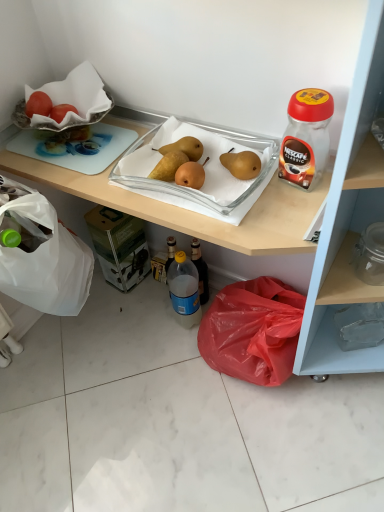
Question: Is transparent plastic jar at upper right, marked as the first bottle in a right-to-left arrangement, shorter than yellow matte pears at center?

Choices:
 (A) no
 (B) yes

Answer: (A)

Question: Does transparent plastic jar at upper right, which is the first bottle from front to back, have a smaller size compared to yellow matte pears at center?

Choices:
 (A) no
 (B) yes

Answer: (A)

Question: Is transparent plastic jar at upper right, which is the first bottle from front to back, facing away from yellow matte pears at center?

Choices:
 (A) yes
 (B) no

Answer: (B)

Question: Can you confirm if transparent plastic jar at upper right, arranged as the second bottle when ordered from the bottom, is thinner than yellow matte pears at center?

Choices:
 (A) yes
 (B) no

Answer: (A)

Question: Is the position of transparent plastic jar at upper right, the 2th bottle when ordered from left to right, more distant than that of yellow matte pears at center?

Choices:
 (A) no
 (B) yes

Answer: (A)

Question: In terms of height, does yellow matte pears at center look taller or shorter compared to transparent plastic jar at upper right, marked as the first bottle in a right-to-left arrangement?

Choices:
 (A) short
 (B) tall

Answer: (A)

Question: Is yellow matte pears at center bigger or smaller than transparent plastic jar at upper right, the 2th bottle when ordered from left to right?

Choices:
 (A) big
 (B) small

Answer: (B)

Question: From the image's perspective, relative to transparent plastic jar at upper right, arranged as the second bottle when ordered from the bottom, is yellow matte pears at center above or below?

Choices:
 (A) below
 (B) above

Answer: (A)

Question: Considering their positions, is yellow matte pears at center located in front of or behind transparent plastic jar at upper right, arranged as the second bottle when ordered from the bottom?

Choices:
 (A) front
 (B) behind

Answer: (B)

Question: In terms of width, does blue translucent bottle at center, the second bottle when ordered from right to left, look wider or thinner when compared to transparent plastic jar at upper right, the first bottle positioned from the top?

Choices:
 (A) thin
 (B) wide

Answer: (B)

Question: Considering the positions of blue translucent bottle at center, which appears as the 1th bottle when viewed from the back, and transparent plastic jar at upper right, the first bottle positioned from the top, in the image, is blue translucent bottle at center, which appears as the 1th bottle when viewed from the back, bigger or smaller than transparent plastic jar at upper right, the first bottle positioned from the top,?

Choices:
 (A) big
 (B) small

Answer: (A)

Question: Is blue translucent bottle at center, the 2th bottle positioned from the top, situated inside transparent plastic jar at upper right, the 2th bottle when ordered from left to right, or outside?

Choices:
 (A) inside
 (B) outside

Answer: (B)

Question: Is blue translucent bottle at center, the second bottle when ordered from right to left, taller or shorter than transparent plastic jar at upper right, the 2th bottle when ordered from left to right?

Choices:
 (A) tall
 (B) short

Answer: (A)

Question: Considering their positions, is smooth red tomato at upper left located in front of or behind matte plastic cabinet at lower right?

Choices:
 (A) behind
 (B) front

Answer: (A)

Question: Which is correct: smooth red tomato at upper left is inside matte plastic cabinet at lower right, or outside of it?

Choices:
 (A) inside
 (B) outside

Answer: (A)